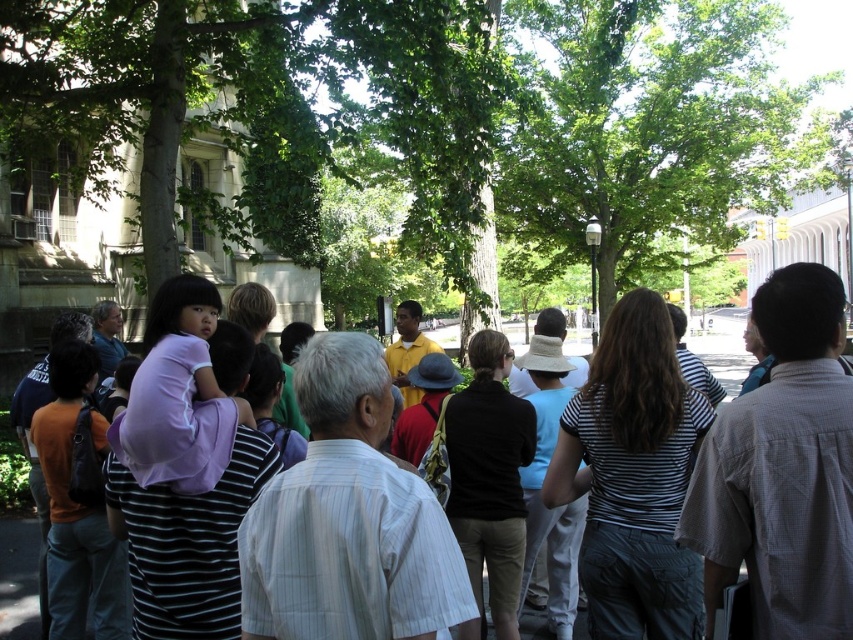
Question: Which object is closer to the camera taking this photo?

Choices:
 (A) purple fabric at center
 (B) green leafy tree at center

Answer: (A)

Question: Which of the following is the closest to the observer?

Choices:
 (A) green leafy tree at center
 (B) purple fabric at center

Answer: (B)

Question: Does green leafy tree at left have a smaller size compared to green leafy tree at center?

Choices:
 (A) yes
 (B) no

Answer: (A)

Question: Which point is farther to the camera?

Choices:
 (A) (151, 227)
 (B) (639, 253)

Answer: (B)

Question: Can you confirm if green leafy tree at left is positioned below purple fabric at center?

Choices:
 (A) yes
 (B) no

Answer: (B)

Question: Does green leafy tree at left appear on the left side of purple fabric at center?

Choices:
 (A) yes
 (B) no

Answer: (A)